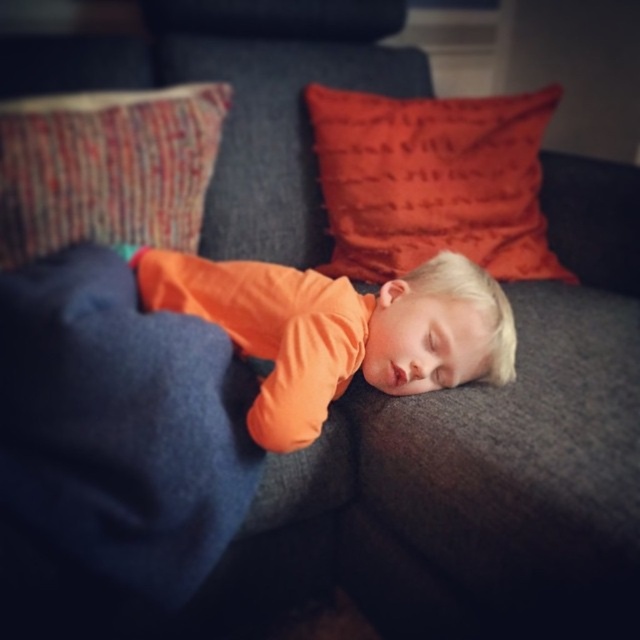
You are a babysitter who needs to ensure the child is safe. The orange soft fabric toddler at center is sleeping on the couch. Is the textured woven pillow at upper left positioned in a way that could block the child from rolling off the couch?

The orange soft fabric toddler at center is in front of the textured woven pillow at upper left, meaning the pillow is behind the child and not positioned to block them from rolling off the couch. You should place the pillow in front of the child to prevent rolling off.

You are a photographer setting up a shoot in this scene. You need to position a small light source so it illuminates the orange soft fabric toddler at center without casting a shadow on the textured woven pillow at upper left. Given their heights, is this possible?

The orange soft fabric toddler at center has a lesser height compared to the textured woven pillow at upper left. Therefore, placing the light source above and slightly behind the toddler would ensure it illuminates them while avoiding casting a shadow on the pillow.

You are a photographer trying to capture the sleeping child on the couch. You notice a point at coordinates [337,330]. What is located at this point?

The point at coordinates [337,330] is where the orange soft fabric toddler is located at center.